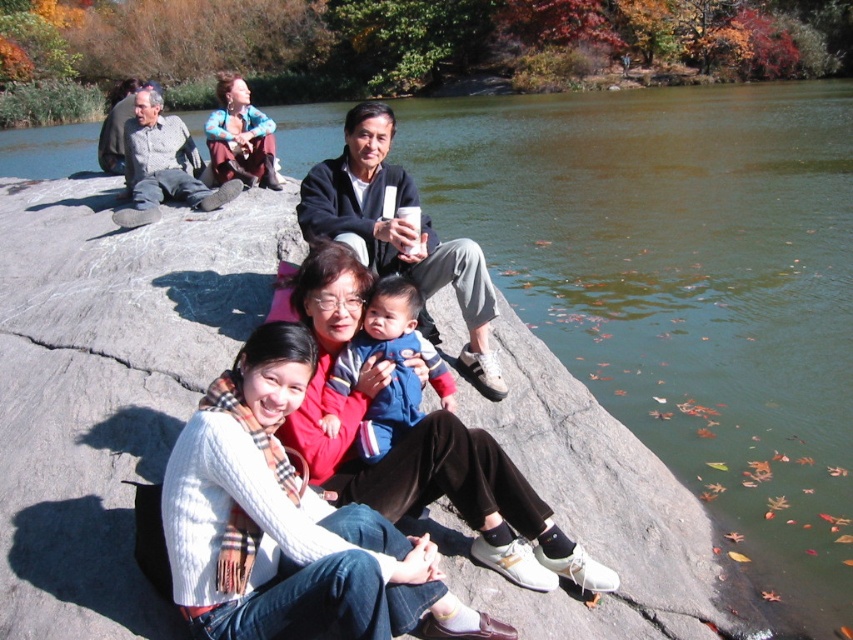
You are a photographer trying to capture a candid shot of the matte black jacket at center and the blue fleece jacket at center. Since you want to ensure both jackets are in focus, you need to know their positions relative to each other. Which jacket is positioned higher in the frame?

The matte black jacket at center is located above the blue fleece jacket at center, so it is positioned higher in the frame.